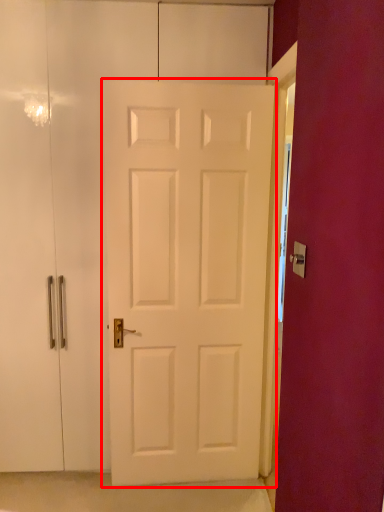
Question: From the image's perspective, what is the correct spatial positioning of door (annotated by the red box) in reference to door handle?

Choices:
 (A) below
 (B) above

Answer: (A)